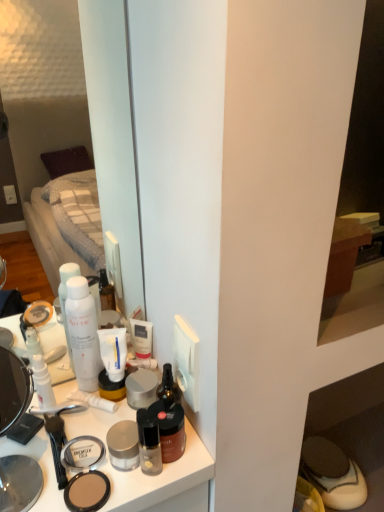
This screenshot has width=384, height=512. Identify the location of free space on the front side of satin silver face powder at center, the third face powder viewed from the front. (115, 456).